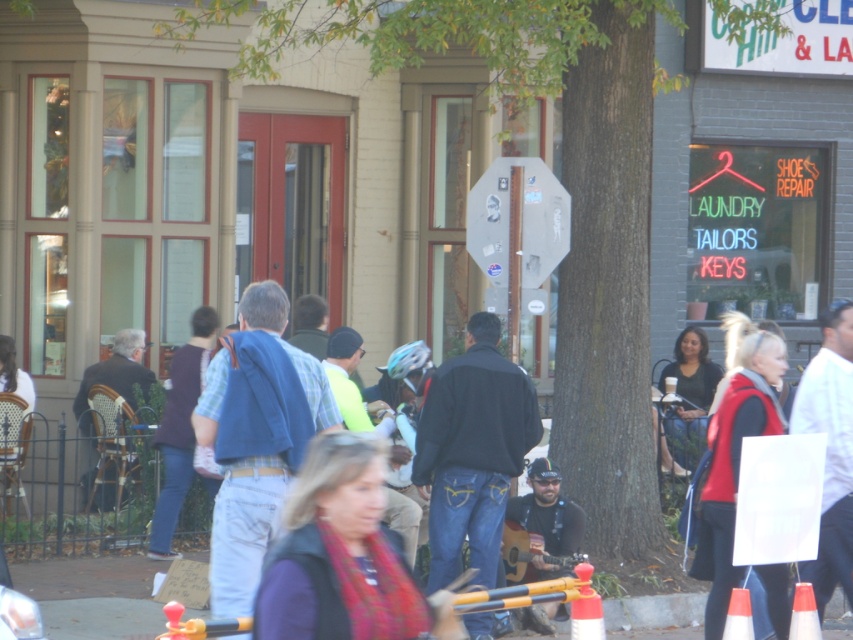
You are a tailor who needs to determine which item, the blue denim vest at center or the white paper sign at center, requires more fabric for a custom replica. Based on the scene, which item would need more fabric?

The blue denim vest at center requires more fabric for a custom replica because its width is larger than the white paper sign at center.

In the scene shown: You are a tailor observing a street scene and need to determine which jacket is more suitable for a client who prefers a compact size. Based on the image, which of the two jackets, the matte black jacket at center or the dark brown leather jacket at left, is smaller?

The matte black jacket at center is smaller than the dark brown leather jacket at left, so it would be the more suitable option for a client preferring a compact size.